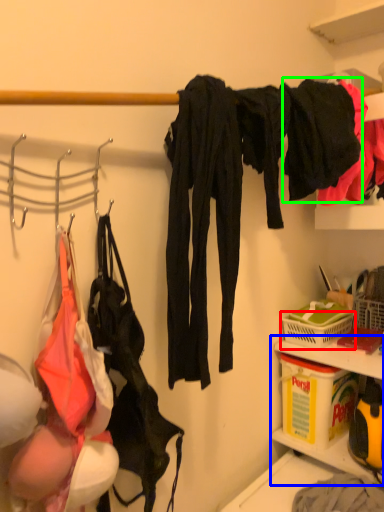
Question: Which is nearer to the basket (highlighted by a red box)? cabinet (highlighted by a blue box) or clothing (highlighted by a green box).

Choices:
 (A) cabinet
 (B) clothing

Answer: (A)